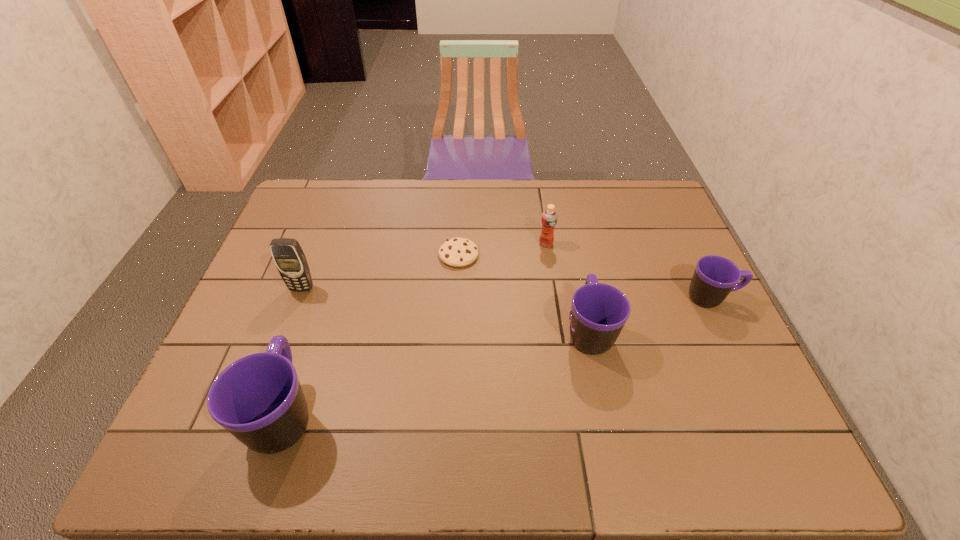
Where is `cellular telephone at the left edge`? cellular telephone at the left edge is located at coordinates (289, 258).

I want to click on object that is at the right edge, so click(715, 277).

The image size is (960, 540). In order to click on object located at the near left corner in this screenshot , I will do coord(258,398).

Where is `vacant space at the far edge of the desktop`? The height and width of the screenshot is (540, 960). vacant space at the far edge of the desktop is located at coordinates point(612,205).

The image size is (960, 540). Identify the location of vacant space at the near edge of the desktop. (339, 414).

In the image, there is a desktop. Where is `blank space at the left edge`? This screenshot has width=960, height=540. blank space at the left edge is located at coordinates (310, 255).

This screenshot has width=960, height=540. I want to click on free space at the right edge of the desktop, so click(649, 285).

The height and width of the screenshot is (540, 960). I want to click on free point between the leftmost mug and the rightmost object, so click(498, 356).

Where is `free space that is in between the second shortest object and the leftmost mug`? The width and height of the screenshot is (960, 540). free space that is in between the second shortest object and the leftmost mug is located at coordinates (498, 356).

At what (x,y) coordinates should I click in order to perform the action: click on free area in between the third object from left to right and the nearest mug. Please return your answer as a coordinate pair (x, y). The height and width of the screenshot is (540, 960). Looking at the image, I should click on (372, 334).